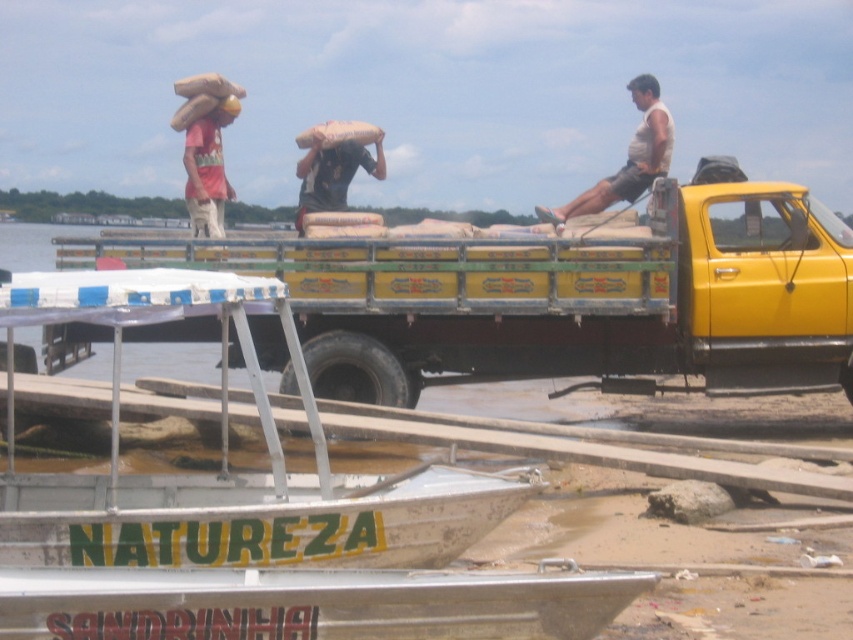
Looking at this image, can you confirm if yellow matte truck at center is shorter than matte red t-shirt at upper left?

In fact, yellow matte truck at center may be taller than matte red t-shirt at upper left.

Between yellow matte truck at center and matte red t-shirt at upper left, which one is positioned higher?

matte red t-shirt at upper left

Does point (322, 259) lie behind point (206, 211)?

No.

The height and width of the screenshot is (640, 853). Find the location of `yellow matte truck at center`. yellow matte truck at center is located at coordinates (564, 300).

Which is above, yellow matte truck at center or matte black bag at center?

matte black bag at center

Locate an element on the screen. This screenshot has width=853, height=640. yellow matte truck at center is located at coordinates (564, 300).

Image resolution: width=853 pixels, height=640 pixels. What are the coordinates of `yellow matte truck at center` in the screenshot? It's located at click(564, 300).

Between white cotton shirt at upper right and matte red t-shirt at upper left, which one is positioned higher?

white cotton shirt at upper right is higher up.

Does white cotton shirt at upper right appear under matte red t-shirt at upper left?

Actually, white cotton shirt at upper right is above matte red t-shirt at upper left.

This screenshot has height=640, width=853. What do you see at coordinates (627, 157) in the screenshot? I see `white cotton shirt at upper right` at bounding box center [627, 157].

At what (x,y) coordinates should I click in order to perform the action: click on white cotton shirt at upper right. Please return your answer as a coordinate pair (x, y). Image resolution: width=853 pixels, height=640 pixels. Looking at the image, I should click on (627, 157).